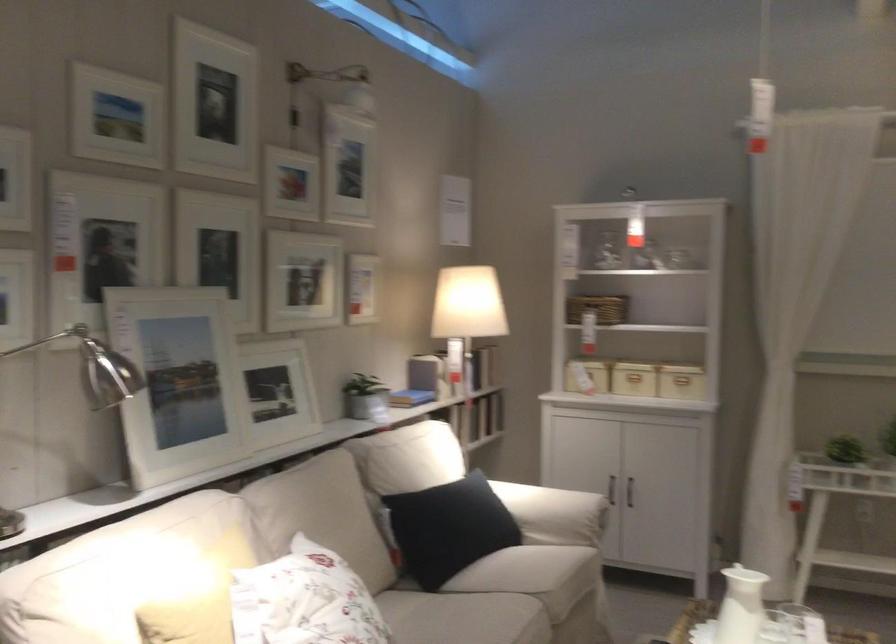
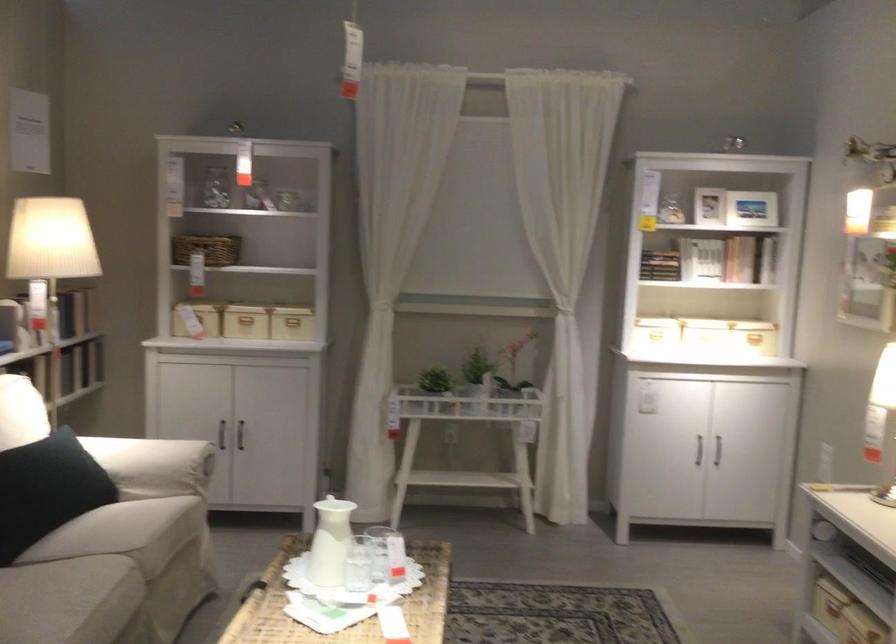
Question: The camera is either moving clockwise (left) or counter-clockwise (right) around the object. The first image is from the beginning of the video and the second image is from the end. Is the camera moving left or right when shooting the video?

Choices:
 (A) Left
 (B) Right

Answer: (A)